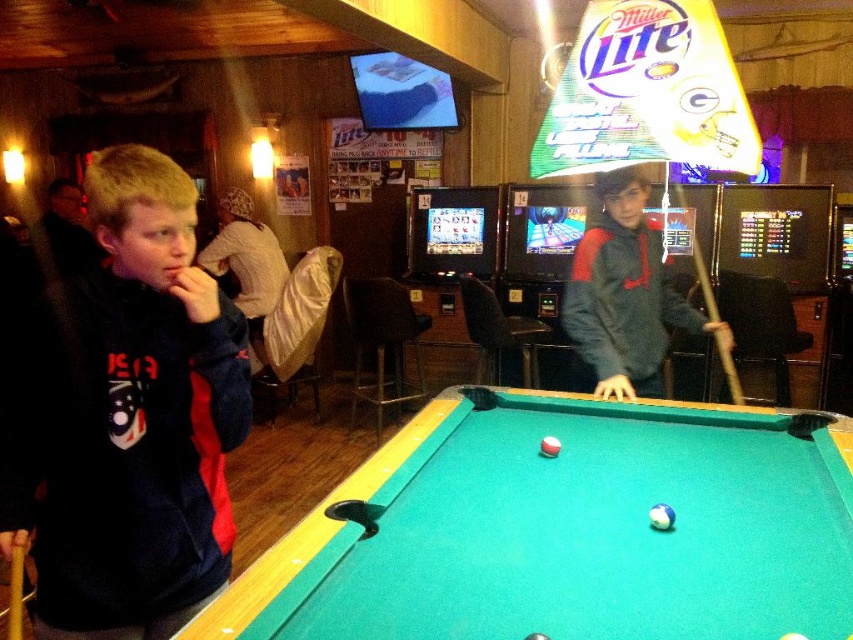
Is green felt pool table at center shorter than dark blue fleece at left?

Yes.

Can you confirm if green felt pool table at center is taller than dark blue fleece at left?

In fact, green felt pool table at center may be shorter than dark blue fleece at left.

Between point (422, 496) and point (230, 531), which one is positioned behind?

Point (422, 496)

I want to click on green felt pool table at center, so click(x=567, y=531).

Does gray fleece hoodie at center lie in front of brown wooden cue at center?

Yes, it is in front of brown wooden cue at center.

Is point (660, 321) behind point (721, 349)?

That is False.

What do you see at coordinates (624, 296) in the screenshot? I see `gray fleece hoodie at center` at bounding box center [624, 296].

At what (x,y) coordinates should I click in order to perform the action: click on gray fleece hoodie at center. Please return your answer as a coordinate pair (x, y). Image resolution: width=853 pixels, height=640 pixels. Looking at the image, I should click on (624, 296).

Who is positioned more to the left, dark blue fleece at left or gray fleece hoodie at center?

dark blue fleece at left is more to the left.

What are the coordinates of `dark blue fleece at left` in the screenshot? It's located at (x=123, y=416).

The image size is (853, 640). I want to click on dark blue fleece at left, so click(123, 416).